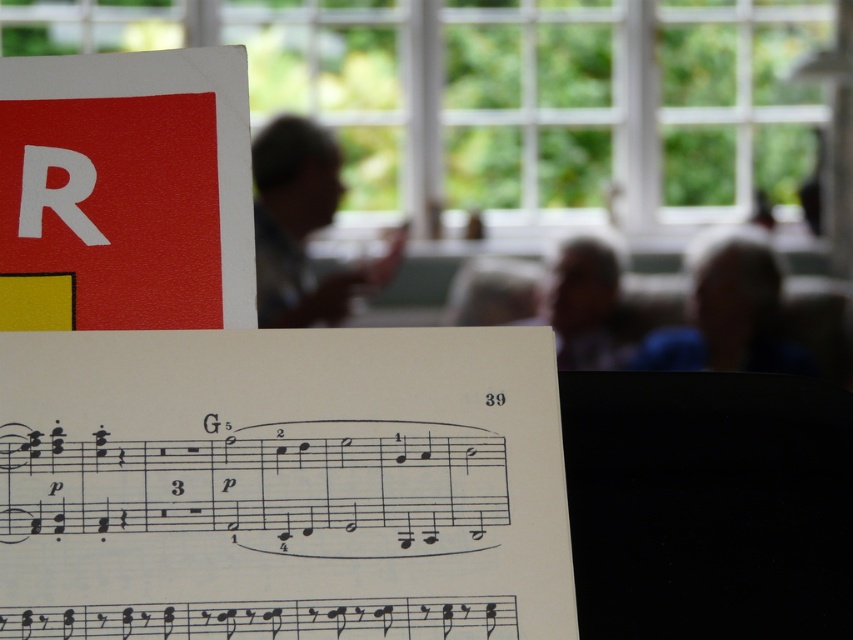
Question: Which point is farther from the camera taking this photo?

Choices:
 (A) (372, 620)
 (B) (372, 276)

Answer: (B)

Question: Is white paper sheet music at center to the left of matte plastic cup at upper center from the viewer's perspective?

Choices:
 (A) yes
 (B) no

Answer: (B)

Question: Is white paper sheet music at center bigger than matte plastic cup at upper center?

Choices:
 (A) yes
 (B) no

Answer: (B)

Question: Can you confirm if white paper sheet music at center is wider than matte plastic cup at upper center?

Choices:
 (A) yes
 (B) no

Answer: (A)

Question: Which point appears closest to the camera in this image?

Choices:
 (A) (328, 182)
 (B) (273, 547)

Answer: (B)